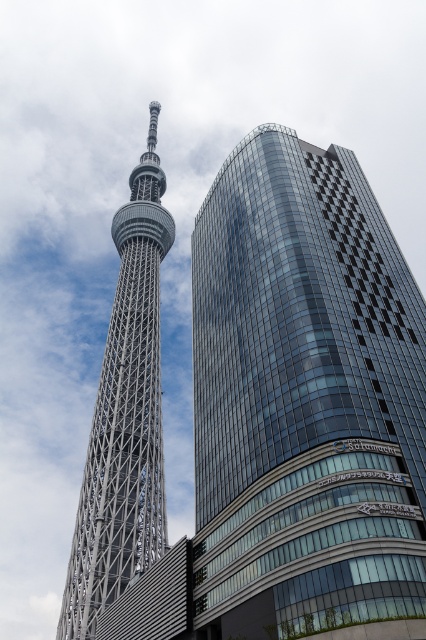
Who is higher up, shiny glass skyscraper at center or silver metallic tower at left?

silver metallic tower at left

Does shiny glass skyscraper at center appear under silver metallic tower at left?

Yes, shiny glass skyscraper at center is below silver metallic tower at left.

Consider the image. Who is more distant from viewer, (x=198, y=339) or (x=146, y=339)?

The point (x=146, y=339) is more distant.

I want to click on shiny glass skyscraper at center, so click(x=302, y=396).